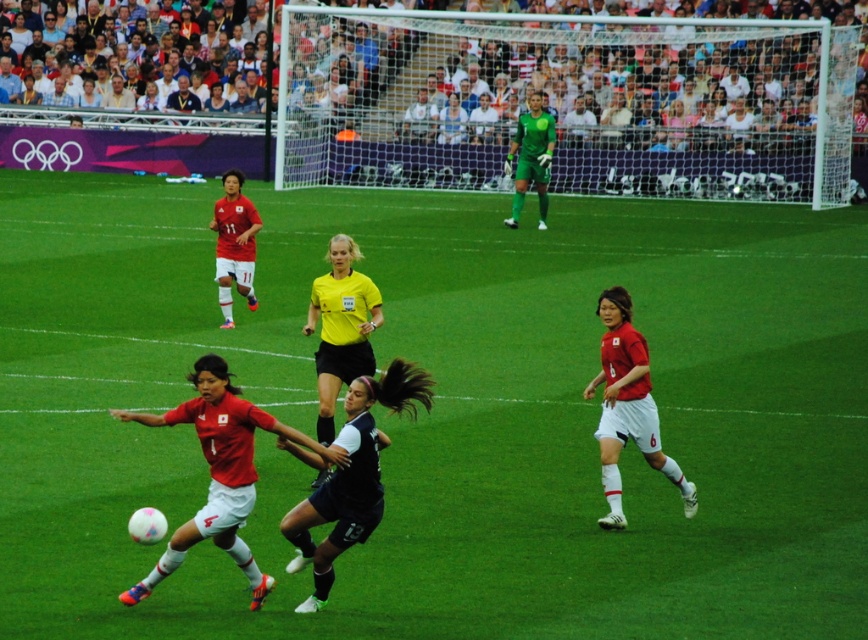
Does green grass football field at center appear over white mesh net at center?

No.

Image resolution: width=868 pixels, height=640 pixels. What do you see at coordinates (441, 413) in the screenshot? I see `green grass football field at center` at bounding box center [441, 413].

The width and height of the screenshot is (868, 640). What are the coordinates of `green grass football field at center` in the screenshot? It's located at (441, 413).

Identify the location of matte red jersey at center. The image size is (868, 640). (220, 472).

Does matte red jersey at center have a greater height compared to black jersey at center?

No, matte red jersey at center is not taller than black jersey at center.

Based on the photo, measure the distance between matte red jersey at center and camera.

matte red jersey at center is 7.79 meters away from camera.

Locate an element on the screen. This screenshot has height=640, width=868. matte red jersey at center is located at coordinates (220, 472).

Between dark blue jersey at center and matte red jersey at right, which one is positioned lower?

dark blue jersey at center is below.

What do you see at coordinates (352, 476) in the screenshot? I see `dark blue jersey at center` at bounding box center [352, 476].

I want to click on dark blue jersey at center, so click(352, 476).